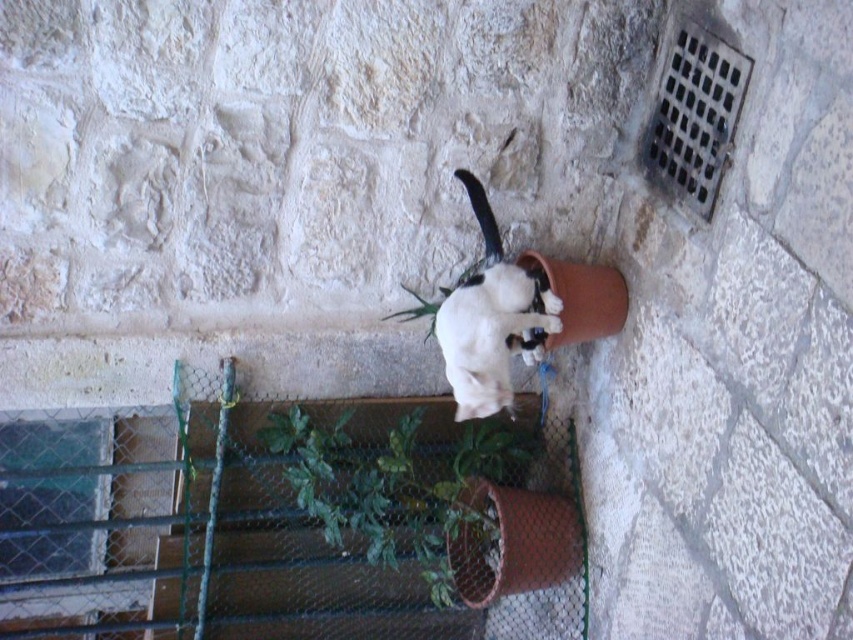
Between green textured plant at center and white fur cat at center, which one has less height?

green textured plant at center is shorter.

Is point (387, 499) farther from camera compared to point (474, 394)?

Yes, it is behind point (474, 394).

Measure the distance between green textured plant at center and camera.

green textured plant at center is 7.00 feet away from camera.

You are a GUI agent. You are given a task and a screenshot of the screen. Output one action in this format:
    pyautogui.click(x=<x>, y=<y>)
    Task: Click on the green textured plant at center
    The height and width of the screenshot is (640, 853).
    Given the screenshot: What is the action you would take?
    pyautogui.click(x=396, y=484)

Where is `green mesh fence at lower left`? This screenshot has height=640, width=853. green mesh fence at lower left is located at coordinates (299, 520).

Which of these two, green mesh fence at lower left or white fur cat at center, stands shorter?

Standing shorter between the two is white fur cat at center.

I want to click on green mesh fence at lower left, so click(x=299, y=520).

The image size is (853, 640). Find the location of `green mesh fence at lower left`. green mesh fence at lower left is located at coordinates (299, 520).

Is green mesh fence at lower left to the right of green textured plant at center from the viewer's perspective?

No, green mesh fence at lower left is not to the right of green textured plant at center.

Does green mesh fence at lower left have a smaller size compared to green textured plant at center?

No, green mesh fence at lower left is not smaller than green textured plant at center.

Who is more distant from viewer, (459, 518) or (486, 467)?

Positioned behind is point (486, 467).

Where is `green mesh fence at lower left`? Image resolution: width=853 pixels, height=640 pixels. green mesh fence at lower left is located at coordinates (299, 520).